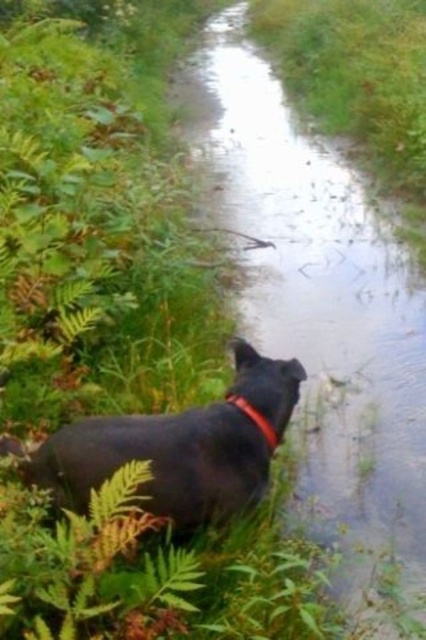
Is clear water at center thinner than black matte dog at lower left?

In fact, clear water at center might be wider than black matte dog at lower left.

This screenshot has height=640, width=426. What are the coordinates of `clear water at center` in the screenshot? It's located at (319, 314).

Does point (282, 307) come closer to viewer compared to point (198, 506)?

No, it is behind (198, 506).

At what (x,y) coordinates should I click in order to perform the action: click on clear water at center. Please return your answer as a coordinate pair (x, y). The image size is (426, 640). Looking at the image, I should click on (319, 314).

Is black matte dog at lower left bigger than red nylon neckband at lower left?

Correct, black matte dog at lower left is larger in size than red nylon neckband at lower left.

Does point (207, 417) come farther from viewer compared to point (238, 403)?

No, it is not.

The image size is (426, 640). Find the location of `black matte dog at lower left`. black matte dog at lower left is located at coordinates (181, 448).

Looking at this image, is clear water at center thinner than red nylon neckband at lower left?

Incorrect, clear water at center's width is not less than red nylon neckband at lower left's.

Can you confirm if clear water at center is smaller than red nylon neckband at lower left?

Actually, clear water at center might be larger than red nylon neckband at lower left.

The width and height of the screenshot is (426, 640). In order to click on clear water at center in this screenshot , I will do `click(319, 314)`.